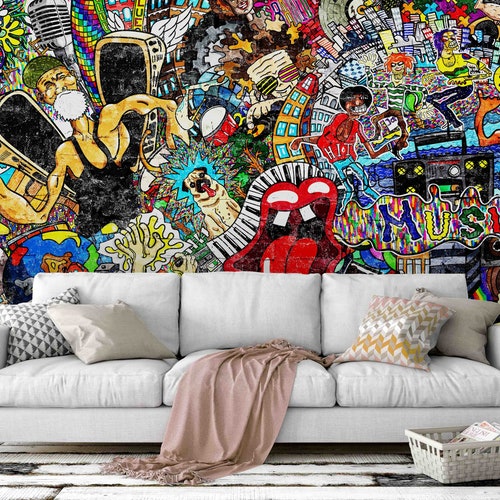
You are a GUI agent. You are given a task and a screenshot of the screen. Output one action in this format:
    pyautogui.click(x=<x>, y=<y>)
    Task: Click on the blanket
    This screenshot has width=500, height=500.
    Given the screenshot: What is the action you would take?
    pyautogui.click(x=256, y=396)